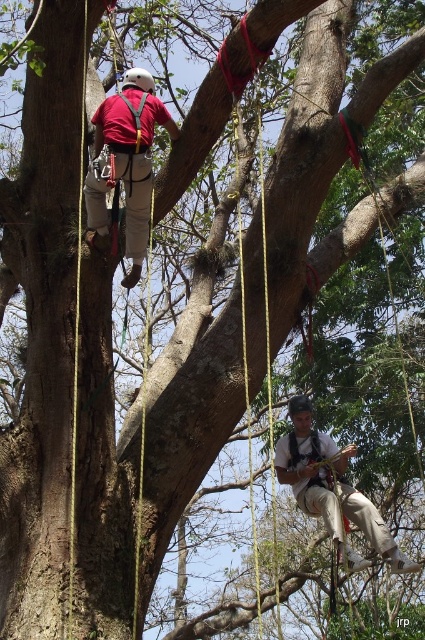
You are planning to place a safety net for the climbers. The safety net must be positioned between the matte red shirt at upper left and the lower climber. Based on their coordinates, where should the safety net be placed?

The safety net should be placed between the matte red shirt at upper left and the lower climber, positioned at point (127, 161) and the lower climber respectively.

You are a safety inspector assessing the tree climbing setup. You notice two climbers wearing the matte red shirt at upper left and the matte khaki pants at lower right. Based on their positions, which climber is at a higher elevation?

The matte red shirt at upper left is taller than the matte khaki pants at lower right, so the climber in the matte red shirt at upper left is at a higher elevation.

You are standing at the base of the tree and want to reach the point marked at coordinates point (x=113, y=99). Given that the distance between you and this point is 31.72 feet, can you estimate how far you need to climb vertically to reach this point?

The vertical distance to reach point (x=113, y=99) is approximately 31.72 feet, as the distance provided is the straight line from the viewer to the point.